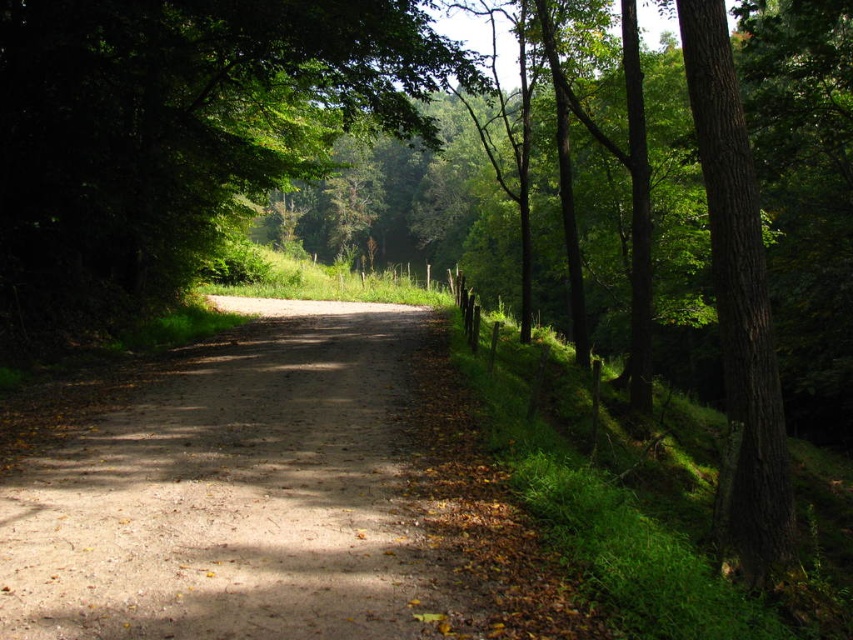
Based on the photo, you are a hiker standing at the start of the dirt path at center. You want to take a photo of the green rough bark tree at right. Which direction should you face to capture the tree in your shot?

The dirt path at center is to the left of green rough bark tree at right, so you should face to the right to capture the tree in your shot.

You are standing at the starting point of the dirt road in this rural scene. There is a green leafy tree at center. Based on its position, can you determine if the tree is closer to the road or the forest edge?

The green leafy tree at center is located at coordinates point (178, 134), which places it closer to the road than the forest edge.

You are a hiker standing on the dirt road in the image. You notice the green leafy tree at center and the green rough bark tree at right. Which tree would you need to look up higher to see the top of?

The green rough bark tree at right is taller than the green leafy tree at center, so you would need to look up higher to see its top.